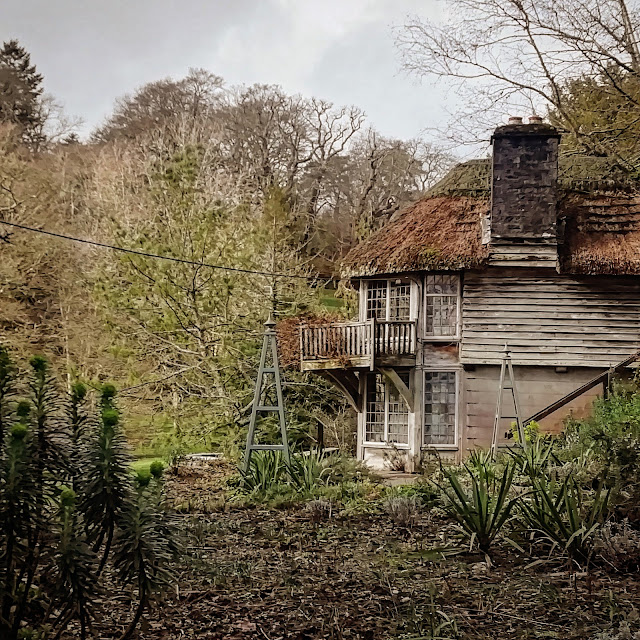
This screenshot has height=640, width=640. I want to click on green plant, so click(x=482, y=523), click(x=575, y=524), click(x=537, y=461), click(x=476, y=463), click(x=273, y=472), click(x=304, y=470).